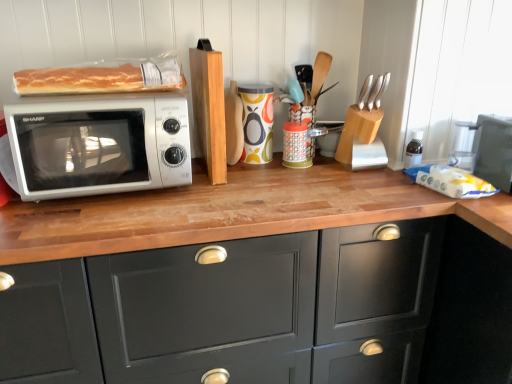
Locate an element on the screen. This screenshot has height=384, width=512. free location in front of wooden knife block at center, arranged as the third appliance when viewed from the right is located at coordinates (342, 171).